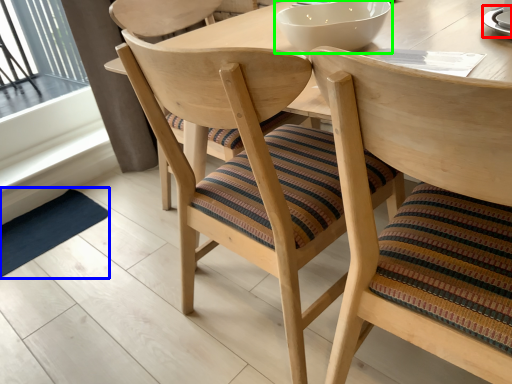
Question: Estimate the real-world distances between objects in this image. Which object is closer to saucer (highlighted by a red box), mat (highlighted by a blue box) or bowl (highlighted by a green box)?

Choices:
 (A) mat
 (B) bowl

Answer: (B)